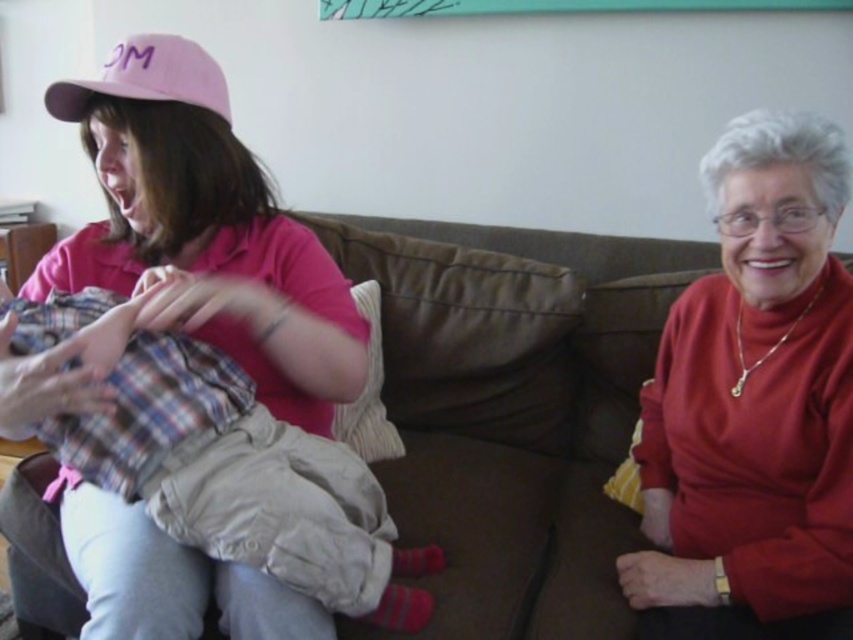
Does plaid fabric baby at center appear under pink fabric cap at upper left?

Yes, plaid fabric baby at center is below pink fabric cap at upper left.

Can you confirm if plaid fabric baby at center is smaller than pink fabric cap at upper left?

Incorrect, plaid fabric baby at center is not smaller in size than pink fabric cap at upper left.

Is point (142, 403) less distant than point (199, 76)?

Yes.

Locate an element on the screen. The image size is (853, 640). plaid fabric baby at center is located at coordinates (225, 461).

Image resolution: width=853 pixels, height=640 pixels. Describe the element at coordinates (752, 401) in the screenshot. I see `matte red sweater at right` at that location.

In the scene shown: Is matte red sweater at right shorter than pink fabric cap at upper left?

No, matte red sweater at right is not shorter than pink fabric cap at upper left.

Find the location of a particular element. matte red sweater at right is located at coordinates (752, 401).

Locate an element on the screen. matte red sweater at right is located at coordinates (752, 401).

Is brown fabric couch at center taller than plaid fabric baby at center?

Correct, brown fabric couch at center is much taller as plaid fabric baby at center.

What do you see at coordinates (514, 410) in the screenshot? I see `brown fabric couch at center` at bounding box center [514, 410].

Where is `brown fabric couch at center`? brown fabric couch at center is located at coordinates (514, 410).